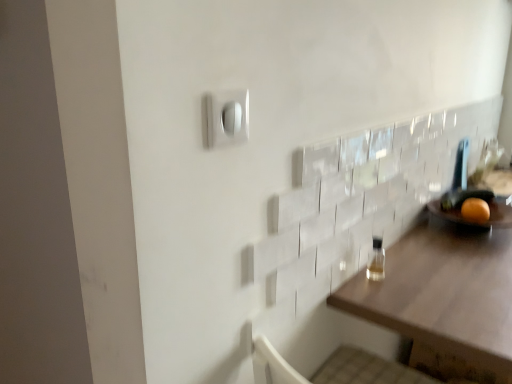
The height and width of the screenshot is (384, 512). Identify the location of vacant space that is in between clear glass bottle at right and orange matte at right. (436, 249).